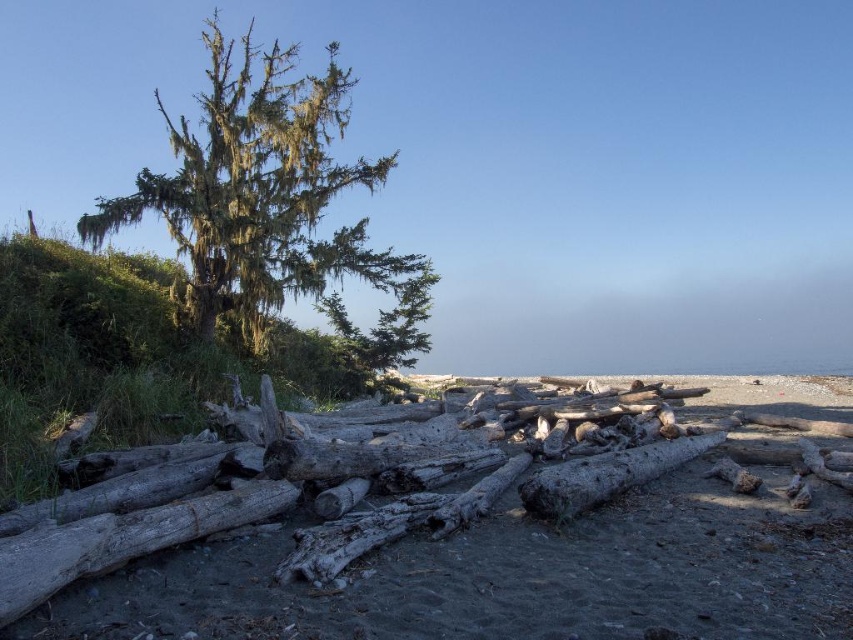
Is point (444, 413) positioned after point (247, 248)?

Yes, it is.

Is weathered wood logs at center thinner than green mossy tree at upper left?

Yes, weathered wood logs at center is thinner than green mossy tree at upper left.

I want to click on weathered wood logs at center, so click(419, 544).